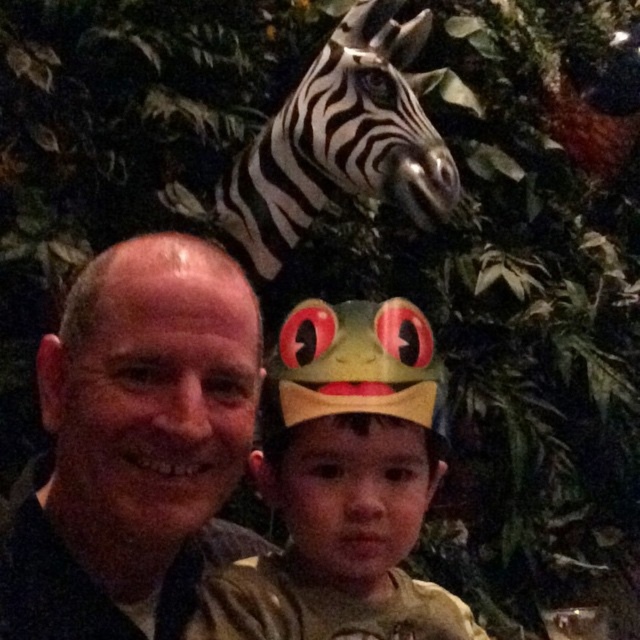
Question: Does matte green paper crown at center appear under matte black head at left?

Choices:
 (A) no
 (B) yes

Answer: (B)

Question: In this image, where is matte green paper crown at center located relative to black and white striped zebra head at upper center?

Choices:
 (A) right
 (B) left

Answer: (A)

Question: Does matte green paper crown at center appear over matte black head at left?

Choices:
 (A) no
 (B) yes

Answer: (A)

Question: Among these points, which one is farthest from the camera?

Choices:
 (A) (44, 353)
 (B) (228, 232)
 (C) (221, 637)

Answer: (B)

Question: Which point appears closest to the camera in this image?

Choices:
 (A) (412, 26)
 (B) (161, 524)

Answer: (B)

Question: Which of the following is the farthest from the observer?

Choices:
 (A) matte green paper crown at center
 (B) matte black head at left
 (C) black and white striped zebra head at upper center

Answer: (C)